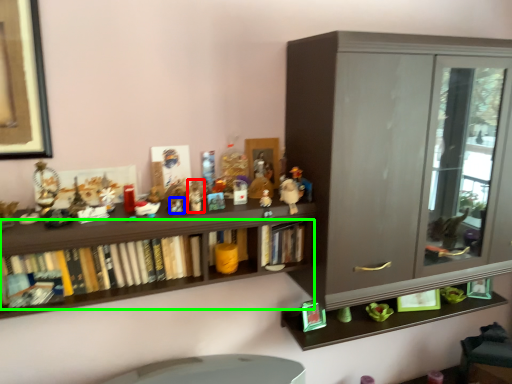
Question: Which is nearer to the toy (highlighted by a red box)? toy (highlighted by a blue box) or book (highlighted by a green box).

Choices:
 (A) toy
 (B) book

Answer: (A)